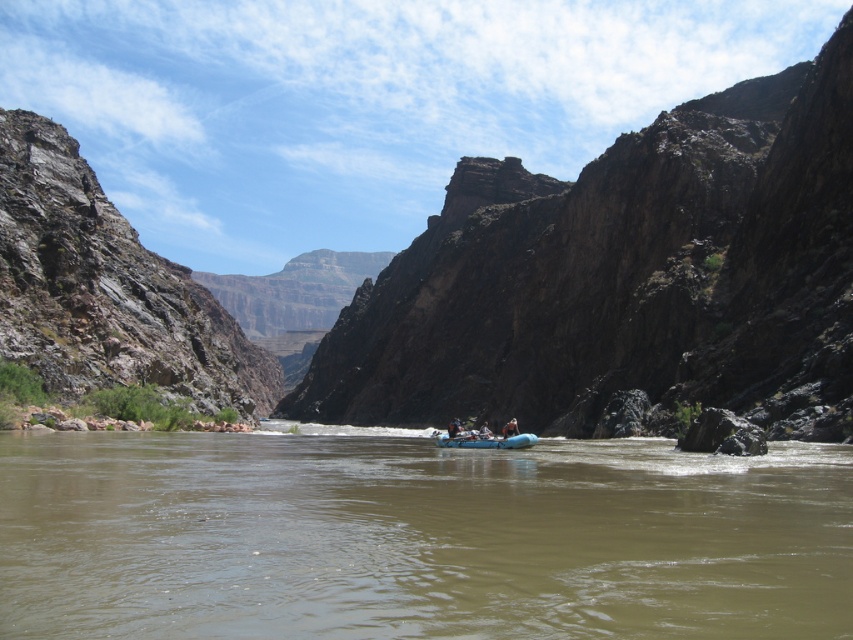
You are planning to take a photo of the brown rocky canyon at center and the blue fabric raft at center from a drone. Which object should you focus on first if you want to capture both in a single frame without zooming in or out? Explain your reasoning based on their sizes.

The brown rocky canyon at center is larger than the blue fabric raft at center. To include both in a single frame without zooming, focus on the larger object first, which is the brown rocky canyon at center, as it occupies more space in the scene. Position the drone to ensure the canyon is framed appropriately, then check if the raft fits within the same composition.

You are a photographer trying to capture both the blue rubber raft at center and the blue fabric raft at center in a single shot. Since the canyon walls are narrow, you need to know their positions relative to each other. Which raft is positioned to the left of the other?

The blue rubber raft at center is to the left of blue fabric raft at center.

You are a geologist analyzing the image and need to locate the brown rocky canyon at center. According to the coordinates provided, where exactly is it positioned?

The brown rocky canyon at center is positioned at coordinates point [625,276].